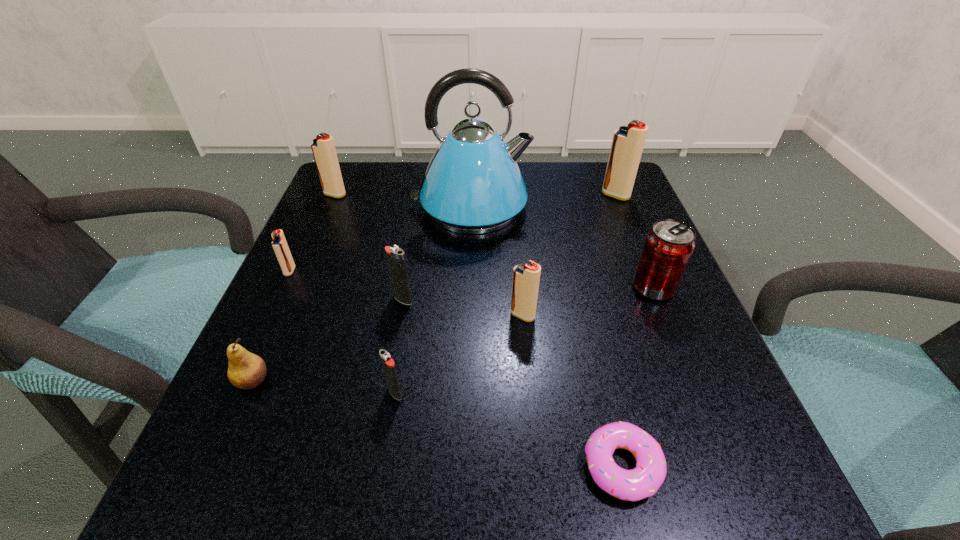
At what (x,y) coordinates should I click in order to perform the action: click on pop soda at the right edge. Please return your answer as a coordinate pair (x, y). The width and height of the screenshot is (960, 540). Looking at the image, I should click on (668, 247).

Identify the location of doughnut present at the right edge. The image size is (960, 540). (636, 484).

Find the location of a particular element. object that is at the far left corner is located at coordinates (323, 148).

Locate an element on the screen. object situated at the far right corner is located at coordinates (627, 145).

Where is `object present at the near right corner`? This screenshot has height=540, width=960. object present at the near right corner is located at coordinates (636, 484).

In the image, there is a desktop. Find the location of `vacant space at the far edge`. vacant space at the far edge is located at coordinates (404, 176).

In the image, there is a desktop. Where is `vacant space at the near edge`? This screenshot has height=540, width=960. vacant space at the near edge is located at coordinates (548, 451).

At what (x,y) coordinates should I click in order to perform the action: click on free spot at the left edge of the desktop. Please return your answer as a coordinate pair (x, y). The width and height of the screenshot is (960, 540). Looking at the image, I should click on (276, 362).

Find the location of a particular element. vacant region at the right edge of the desktop is located at coordinates (632, 233).

Find the location of a particular element. The width and height of the screenshot is (960, 540). vacant space at the far left corner of the desktop is located at coordinates (349, 169).